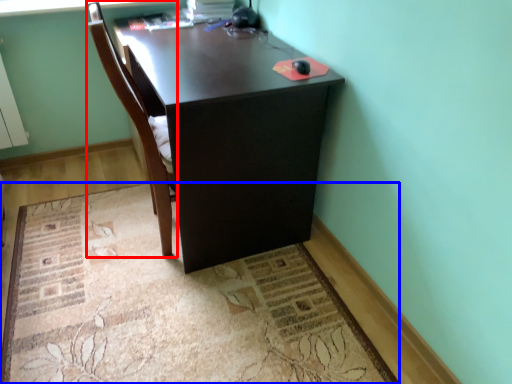
Question: Which object appears farthest to the camera in this image, chair (highlighted by a red box) or mat (highlighted by a blue box)?

Choices:
 (A) chair
 (B) mat

Answer: (A)